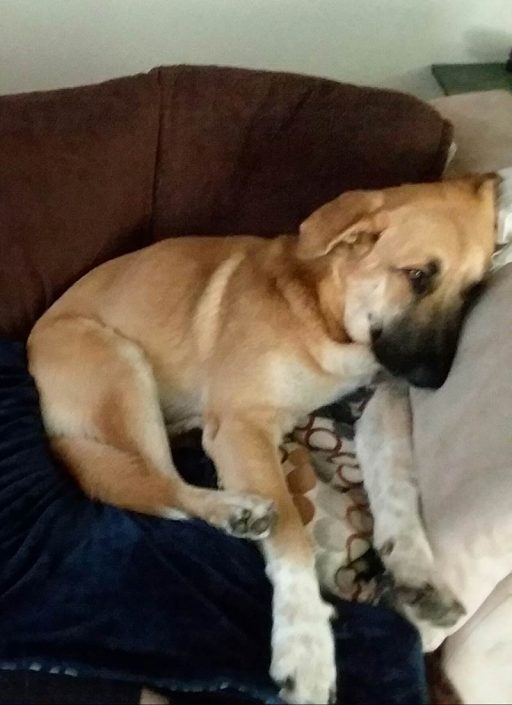
At what (x,y) coordinates should I click in order to perform the action: click on white pillow. Please return your answer as a coordinate pair (x, y). The image size is (512, 705). Looking at the image, I should click on point(487,373).